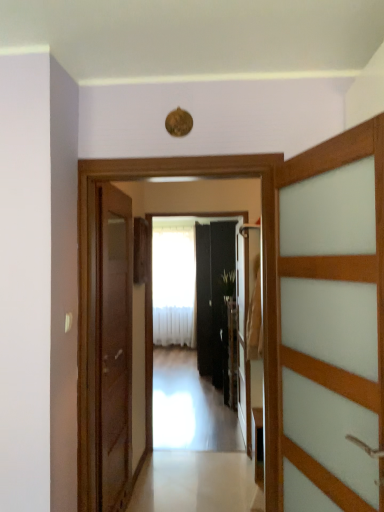
Measure the distance between point (184,333) and camera.

22.76 feet.

What do you see at coordinates (228, 283) in the screenshot? The image size is (384, 512). I see `green leafy plant at center` at bounding box center [228, 283].

Find the location of a particular element. white glossy floor at center is located at coordinates (196, 483).

Where is `transparent glass elevator at center`? This screenshot has height=512, width=384. transparent glass elevator at center is located at coordinates (264, 276).

You are a GUI agent. You are given a task and a screenshot of the screen. Output one action in this format:
    pyautogui.click(x=<x>, y=<y>)
    Task: Click on the black glossy door at center, which is the third door in front-to-back order
    The height and width of the screenshot is (512, 384).
    Given the screenshot: What is the action you would take?
    pyautogui.click(x=213, y=294)

Identify the location of white sheer curtain at center. This screenshot has width=384, height=512. (174, 286).

Would you say white sheer curtain at center is a long distance from wooden door at right, the 1th door positioned from the front?

white sheer curtain at center is far away from wooden door at right, the 1th door positioned from the front.

Can wooden door at right, marked as the 3th door in a back-to-front arrangement, be found inside white sheer curtain at center?

No, wooden door at right, marked as the 3th door in a back-to-front arrangement, is not surrounded by white sheer curtain at center.

Which object is more forward, white sheer curtain at center or wooden door at right, the 1th door positioned from the front?

wooden door at right, the 1th door positioned from the front, is in front.

From a real-world perspective, which object stands above the other?

From a 3D spatial view, wooden door at right, marked as the second door in a left-to-right arrangement, is above.

Is black glossy door at center, which is the third door in front-to-back order, taller than wooden door at right, the 1th door positioned from the front?

Yes.

Who is bigger, black glossy door at center, the 1th door viewed from the back, or wooden door at right, the 1th door positioned from the front?

With larger size is black glossy door at center, the 1th door viewed from the back.

Is black glossy door at center, the 1th door viewed from the back, oriented away from wooden door at right, which ranks as the second door in right-to-left order?

No, black glossy door at center, the 1th door viewed from the back,'s orientation is not away from wooden door at right, which ranks as the second door in right-to-left order.

Is green leafy plant at center bigger or smaller than transparent glass elevator at center?

green leafy plant at center is smaller than transparent glass elevator at center.

Does green leafy plant at center have a lesser height compared to transparent glass elevator at center?

Correct, green leafy plant at center is not as tall as transparent glass elevator at center.

Which is more to the right, green leafy plant at center or transparent glass elevator at center?

From the viewer's perspective, green leafy plant at center appears more on the right side.

Between point (232, 277) and point (173, 163), which one is positioned behind?

The point (232, 277) is farther from the camera.

Find the location of a particular element. This screenshot has width=384, height=512. plant above the black glossy door at center, which is the third door in front-to-back order (from the image's perspective) is located at coordinates (228, 283).

Considering the positions of points (233, 293) and (206, 339), is point (233, 293) closer to camera compared to point (206, 339)?

Yes, point (233, 293) is closer to viewer.

Is the surface of green leafy plant at center in direct contact with black glossy door at center, which is the third door in front-to-back order?

No, green leafy plant at center is not making contact with black glossy door at center, which is the third door in front-to-back order.

Considering the sizes of objects wooden door at right, marked as the 3th door in a back-to-front arrangement, and wooden door at left, acting as the 1th door starting from the left, in the image provided, who is shorter, wooden door at right, marked as the 3th door in a back-to-front arrangement, or wooden door at left, acting as the 1th door starting from the left,?

Standing shorter between the two is wooden door at right, marked as the 3th door in a back-to-front arrangement.

Considering the positions of point (382, 482) and point (109, 338), is point (382, 482) closer or farther from the camera than point (109, 338)?

Point (382, 482).

From the image's perspective, between wooden door at right, marked as the second door in a left-to-right arrangement, and wooden door at left, the third door in the right-to-left sequence, which one is located above?

wooden door at right, marked as the second door in a left-to-right arrangement, from the image's perspective.

Where is `door that is the 2nd object located above the wooden door at left, positioned as the 2th door in front-to-back order (from the image's perspective)`? The height and width of the screenshot is (512, 384). door that is the 2nd object located above the wooden door at left, positioned as the 2th door in front-to-back order (from the image's perspective) is located at coordinates (331, 322).

This screenshot has height=512, width=384. Find the location of `elevator in front of the green leafy plant at center`. elevator in front of the green leafy plant at center is located at coordinates click(264, 276).

From a real-world perspective, is transparent glass elevator at center below green leafy plant at center?

Yes, from a real-world perspective, transparent glass elevator at center is below green leafy plant at center.

Which object is further away from the camera taking this photo, transparent glass elevator at center or green leafy plant at center?

green leafy plant at center is further from the camera.

Is transparent glass elevator at center to the left of green leafy plant at center from the viewer's perspective?

Yes.

Does transparent glass elevator at center have a larger size compared to wooden door at right, marked as the second door in a left-to-right arrangement?

Indeed, transparent glass elevator at center has a larger size compared to wooden door at right, marked as the second door in a left-to-right arrangement.

Looking at this image, is transparent glass elevator at center thinner than wooden door at right, marked as the 3th door in a back-to-front arrangement?

No, transparent glass elevator at center is not thinner than wooden door at right, marked as the 3th door in a back-to-front arrangement.

From a real-world perspective, which is physically below, transparent glass elevator at center or wooden door at right, marked as the 3th door in a back-to-front arrangement?

transparent glass elevator at center, from a real-world perspective.

From the image's perspective, is transparent glass elevator at center over wooden door at right, which ranks as the second door in right-to-left order?

No, from the image's perspective, transparent glass elevator at center is not over wooden door at right, which ranks as the second door in right-to-left order.

This screenshot has height=512, width=384. What are the coordinates of `curtain behind the wooden door at right, marked as the second door in a left-to-right arrangement` in the screenshot? It's located at (174, 286).

Identify the location of door above the black glossy door at center, arranged as the 1th door when viewed from the right (from a real-world perspective). (331, 322).

From the picture: Which object lies further to the anchor point green leafy plant at center, black glossy door at center, which is the third door in front-to-back order, or white sheer curtain at center?

The object further to green leafy plant at center is white sheer curtain at center.

From the image, which object appears to be nearer to green leafy plant at center, white glossy floor at center or transparent glass elevator at center?

Based on the image, white glossy floor at center appears to be nearer to green leafy plant at center.

When comparing their distances from wooden door at right, which ranks as the second door in right-to-left order, does green leafy plant at center or white glossy floor at center seem closer?

white glossy floor at center.

Estimate the real-world distances between objects in this image. Which object is further from white glossy floor at center, transparent glass elevator at center or black glossy door at center, which is the third door in front-to-back order?

black glossy door at center, which is the third door in front-to-back order, is positioned further to the anchor white glossy floor at center.

Based on the photo, looking at the image, which one is located closer to transparent glass elevator at center, green leafy plant at center or wooden door at right, marked as the 3th door in a back-to-front arrangement?

The object closer to transparent glass elevator at center is wooden door at right, marked as the 3th door in a back-to-front arrangement.

Looking at the image, which one is located closer to green leafy plant at center, transparent glass elevator at center or black glossy door at center, arranged as the 1th door when viewed from the right?

black glossy door at center, arranged as the 1th door when viewed from the right, lies closer to green leafy plant at center than the other object.

Estimate the real-world distances between objects in this image. Which object is further from black glossy door at center, the 1th door viewed from the back, wooden door at right, the 1th door positioned from the front, or transparent glass elevator at center?

transparent glass elevator at center.

From the image, which object appears to be nearer to black glossy door at center, arranged as the 1th door when viewed from the right, white glossy floor at center or transparent glass elevator at center?

white glossy floor at center lies closer to black glossy door at center, arranged as the 1th door when viewed from the right, than the other object.

Find the location of `path between wooden door at left, positioned as the 2th door in front-to-back order, and white sheer curtain at center, along the z-axis`. path between wooden door at left, positioned as the 2th door in front-to-back order, and white sheer curtain at center, along the z-axis is located at coordinates (196, 483).

Locate an element on the screen. This screenshot has height=512, width=384. elevator positioned between wooden door at right, marked as the second door in a left-to-right arrangement, and black glossy door at center, which is the third door in front-to-back order, from near to far is located at coordinates (264, 276).

The width and height of the screenshot is (384, 512). I want to click on path located between wooden door at right, marked as the 3th door in a back-to-front arrangement, and green leafy plant at center in the depth direction, so click(x=196, y=483).

The image size is (384, 512). Identify the location of door located between transparent glass elevator at center and black glossy door at center, arranged as the 1th door when viewed from the right, in the depth direction. (115, 346).